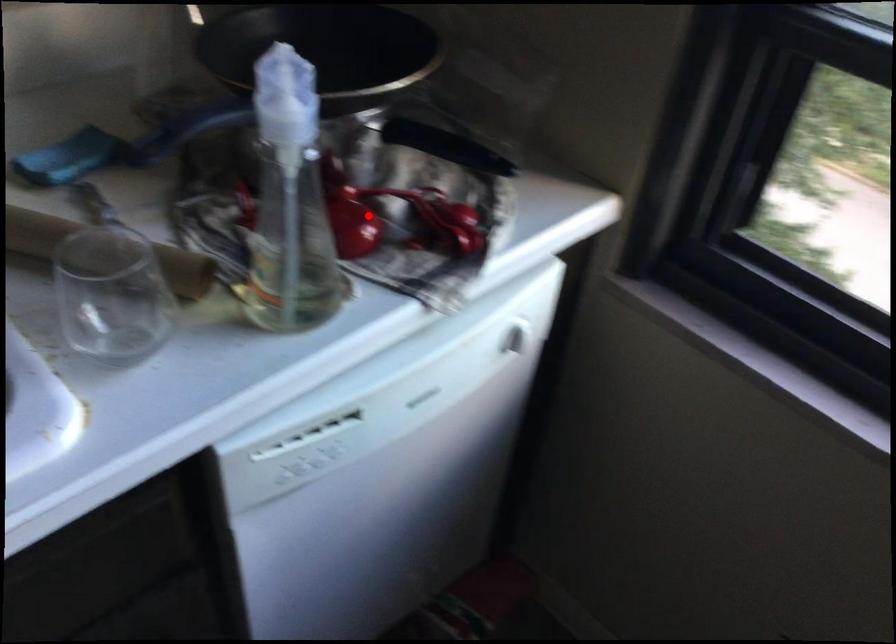
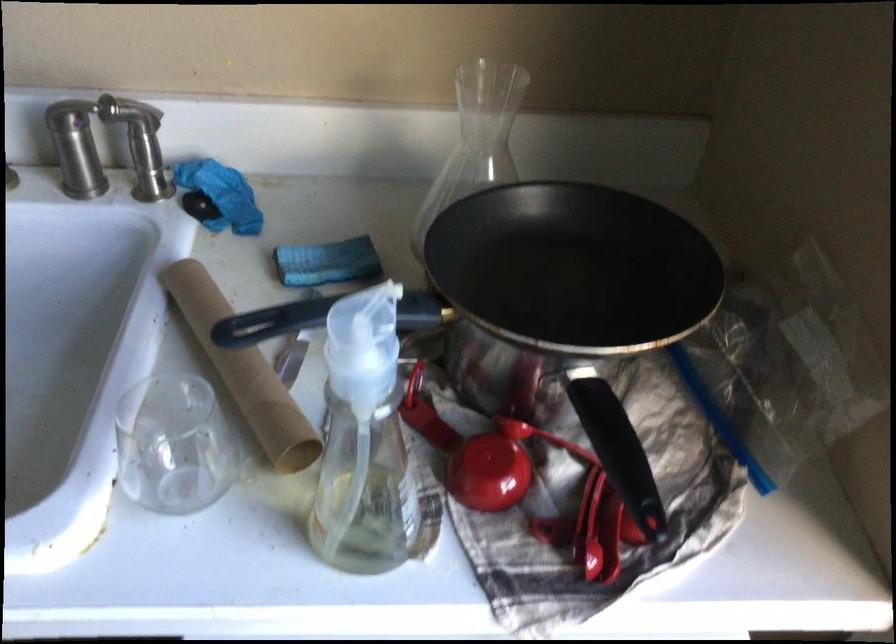
Question: I am providing you with two images of the same scene from different viewpoints. Given a red point in image1, look at the same physical point in image2. Is it:

Choices:
 (A) Closer to the viewpoint
 (B) Farther from the viewpoint

Answer: (A)